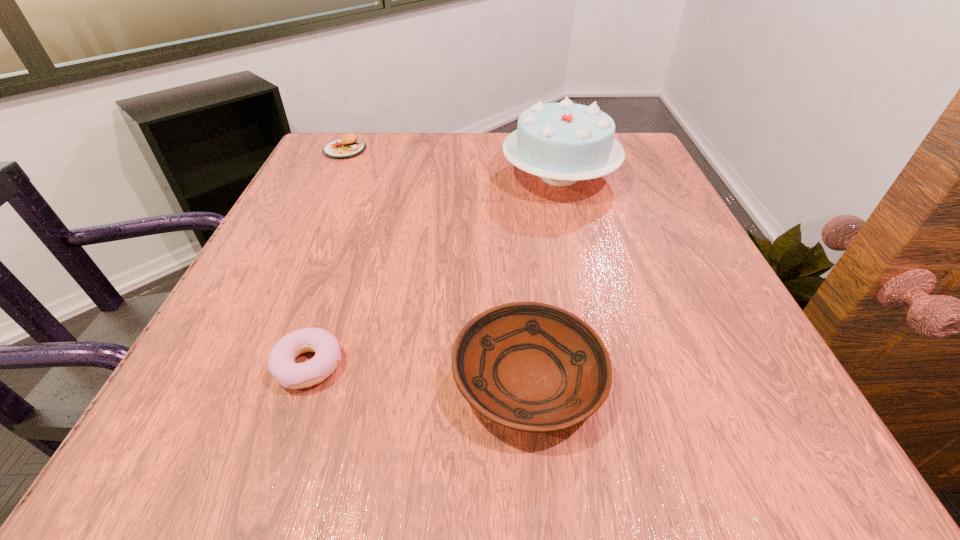
The width and height of the screenshot is (960, 540). In order to click on object that is positioned at the near edge in this screenshot , I will do `click(532, 367)`.

At what (x,y) coordinates should I click in order to perform the action: click on patty situated at the left edge. Please return your answer as a coordinate pair (x, y). This screenshot has height=540, width=960. Looking at the image, I should click on (348, 146).

I want to click on doughnut located in the left edge section of the desktop, so click(281, 364).

Identify the location of object located at the right edge. (562, 143).

In order to click on object located in the far left corner section of the desktop in this screenshot , I will do `click(348, 146)`.

You are a GUI agent. You are given a task and a screenshot of the screen. Output one action in this format:
    pyautogui.click(x=<x>, y=<y>)
    Task: Click on the object that is at the far right corner
    
    Given the screenshot: What is the action you would take?
    pyautogui.click(x=562, y=143)

What are the coordinates of `vacant area at the far edge` in the screenshot? It's located at (388, 134).

The width and height of the screenshot is (960, 540). In the image, there is a desktop. Find the location of `blank space at the left edge`. blank space at the left edge is located at coordinates (280, 295).

This screenshot has height=540, width=960. I want to click on vacant space at the right edge of the desktop, so click(x=638, y=254).

The height and width of the screenshot is (540, 960). In the image, there is a desktop. Find the location of `free space at the far left corner`. free space at the far left corner is located at coordinates (325, 136).